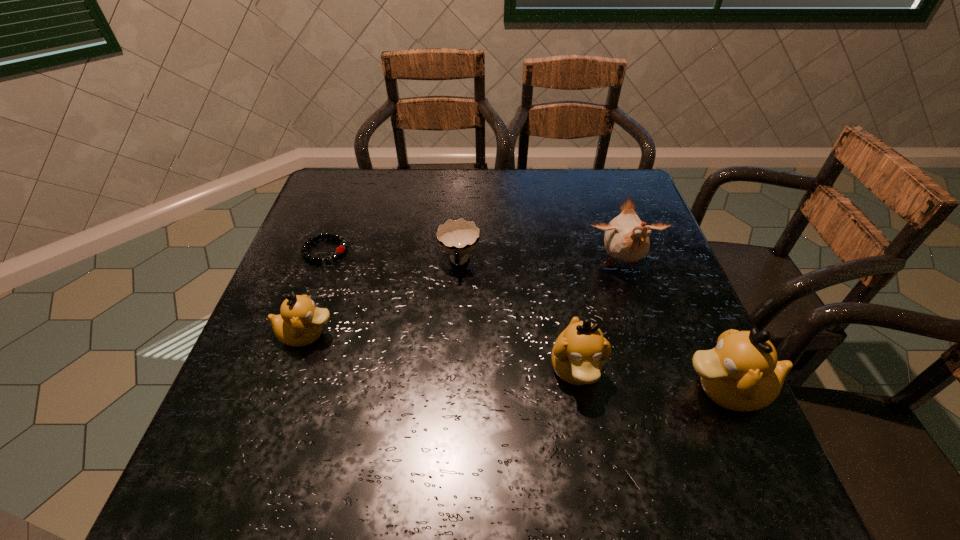
What are the coordinates of `bird positioned at the right edge` in the screenshot? It's located at (626, 238).

This screenshot has height=540, width=960. I want to click on object that is at the near right corner, so click(x=741, y=373).

Locate an element on the screen. free space at the far edge of the desktop is located at coordinates click(x=487, y=208).

Where is `vacant space at the near edge of the desktop`? vacant space at the near edge of the desktop is located at coordinates (540, 413).

In the image, there is a desktop. At what (x,y) coordinates should I click in order to perform the action: click on free region at the left edge. Please return your answer as a coordinate pair (x, y). Looking at the image, I should click on (316, 299).

Locate an element on the screen. vacant space at the right edge is located at coordinates (640, 366).

The width and height of the screenshot is (960, 540). I want to click on free region at the far left corner, so click(x=369, y=207).

This screenshot has height=540, width=960. I want to click on free space between the rightmost duckling and the shortest object, so click(525, 320).

You are a GUI agent. You are given a task and a screenshot of the screen. Output one action in this format:
    pyautogui.click(x=<x>, y=<y>)
    Task: Click on the blank region between the bird and the second duckling from left to right
    
    Given the screenshot: What is the action you would take?
    pyautogui.click(x=598, y=317)

What are the coordinates of `unoccupied area between the rightmost duckling and the shortest object` in the screenshot? It's located at (525, 320).